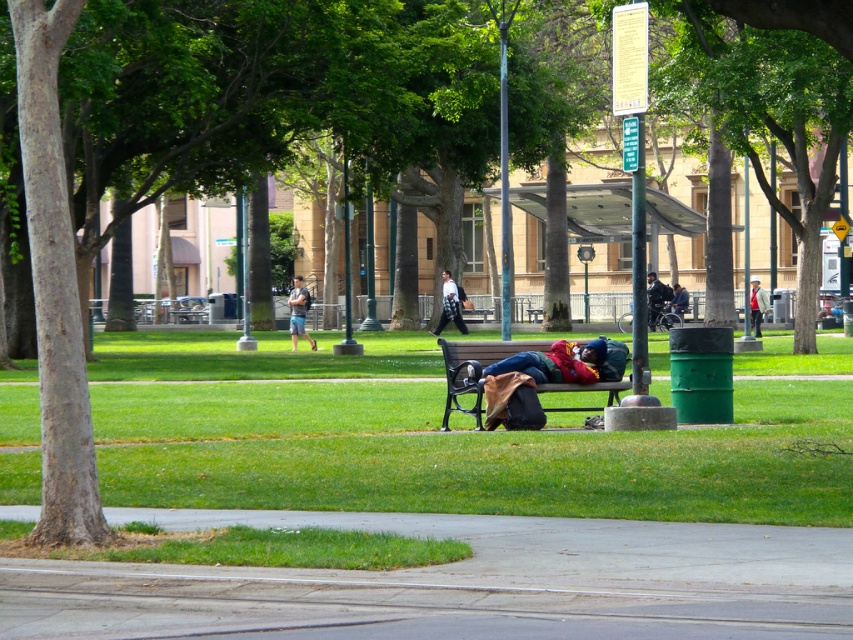
Is denim shorts at center to the right of dark blue jeans at center from the viewer's perspective?

No, denim shorts at center is not to the right of dark blue jeans at center.

The width and height of the screenshot is (853, 640). What do you see at coordinates (299, 310) in the screenshot? I see `denim shorts at center` at bounding box center [299, 310].

Is point (299, 314) positioned behind point (679, 314)?

No, (299, 314) is closer to viewer.

Locate an element on the screen. The image size is (853, 640). denim shorts at center is located at coordinates (299, 310).

Does green grass at lower center appear on the left side of denim shorts at center?

Incorrect, green grass at lower center is not on the left side of denim shorts at center.

The width and height of the screenshot is (853, 640). I want to click on green grass at lower center, so coord(467,456).

This screenshot has height=640, width=853. Describe the element at coordinates (796, 17) in the screenshot. I see `green leafy tree at center` at that location.

Which of these two, green leafy tree at center or denim shorts at center, stands shorter?

denim shorts at center is shorter.

Which is behind, point (840, 35) or point (305, 292)?

Point (305, 292)

Find the location of a particular element. green leafy tree at center is located at coordinates (796, 17).